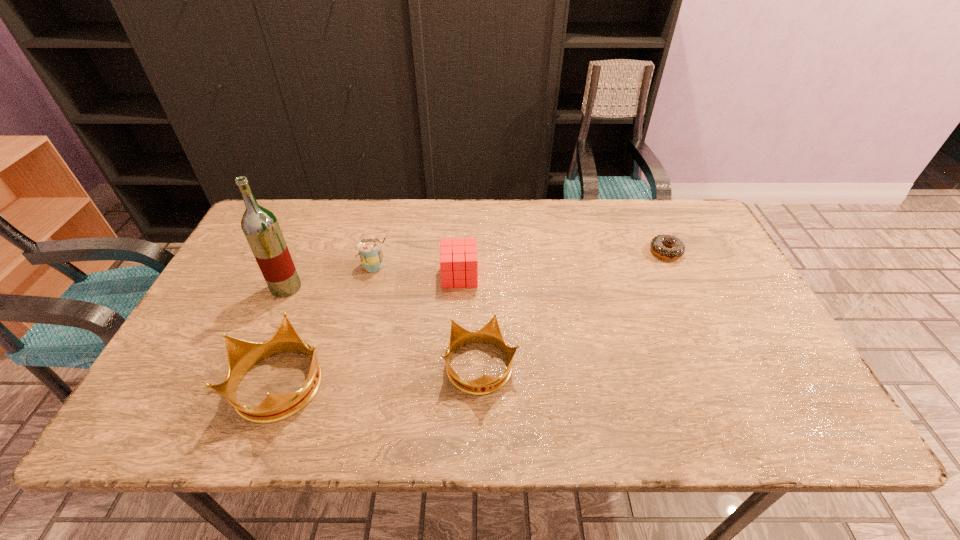
Locate an element on the screen. This screenshot has height=540, width=960. free space located on the front of the cube is located at coordinates (456, 341).

Locate an element on the screen. Image resolution: width=960 pixels, height=540 pixels. free region located on the left of the can is located at coordinates (321, 266).

The height and width of the screenshot is (540, 960). Identify the location of vacant area located 0.350m on the front of the rightmost object. (717, 362).

The width and height of the screenshot is (960, 540). I want to click on object located in the far edge section of the desktop, so click(658, 243).

Where is `object present at the left edge`? This screenshot has height=540, width=960. object present at the left edge is located at coordinates (260, 226).

Where is `object located at the right edge`? The width and height of the screenshot is (960, 540). object located at the right edge is located at coordinates (658, 243).

You are a GUI agent. You are given a task and a screenshot of the screen. Output one action in this format:
    pyautogui.click(x=<x>, y=<y>)
    Task: Click on the object that is positioned at the far right corner
    This screenshot has height=540, width=960.
    Given the screenshot: What is the action you would take?
    pyautogui.click(x=658, y=243)

This screenshot has width=960, height=540. I want to click on blank space at the far edge of the desktop, so click(x=480, y=215).

You are a GUI agent. You are given a task and a screenshot of the screen. Output one action in this format:
    pyautogui.click(x=<x>, y=<y>)
    Task: Click on the blank space at the near edge of the desktop
    
    Given the screenshot: What is the action you would take?
    pyautogui.click(x=277, y=374)

The image size is (960, 540). What are the coordinates of `vacant area at the left edge` in the screenshot? It's located at (247, 277).